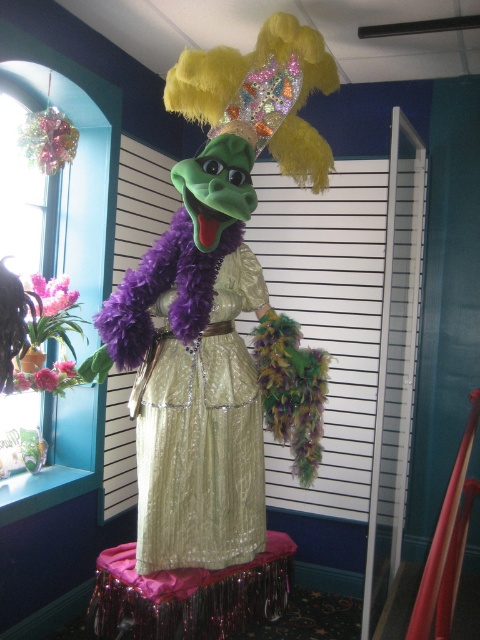
You are a customer in a costume shop and you want to try on the gold sequined dress at center and the purple sequined skirt at center. If you first approach the one that is on the left side, which one should you go to?

The gold sequined dress at center is to the right of purple sequined skirt at center, so you should go to the purple sequined skirt at center first as it is on the left side.

You are a photographer trying to capture the shiny gold dress at center and the purple sequined skirt at center in a single shot. Which one should you focus on first to ensure both are in focus?

The shiny gold dress at center is closer to the viewer than the purple sequined skirt at center, so focusing on the shiny gold dress at center first will help ensure both are in focus.